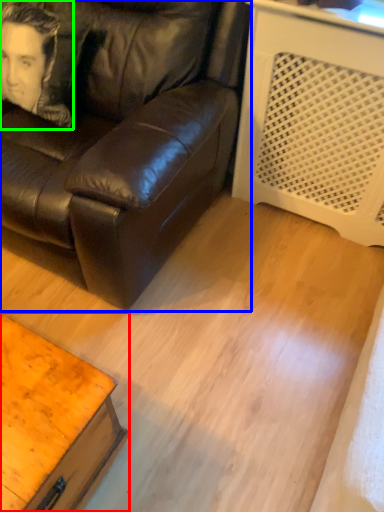
Question: Estimate the real-world distances between objects in this image. Which object is farther from table (highlighted by a red box), studio couch (highlighted by a blue box) or man (highlighted by a green box)?

Choices:
 (A) studio couch
 (B) man

Answer: (B)